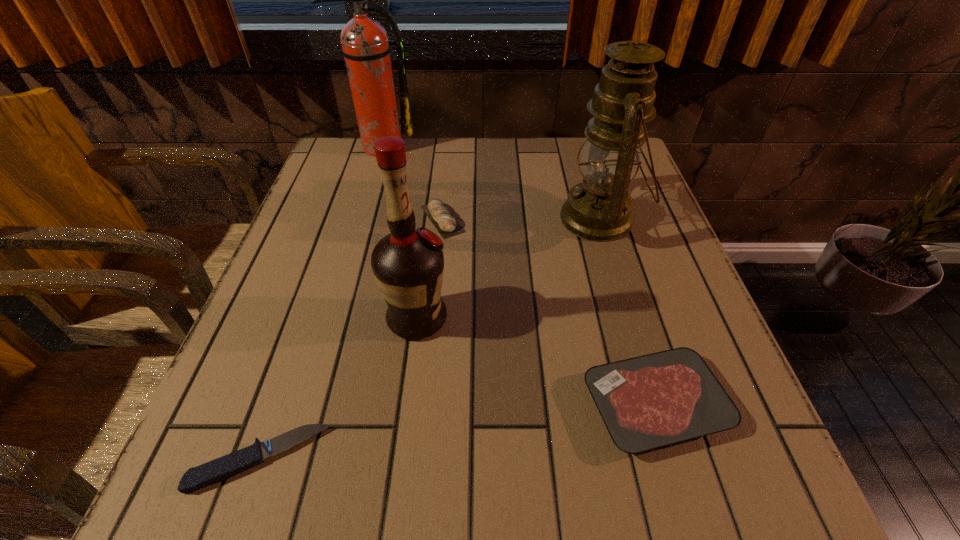
Where is `object present at the near left corner`? object present at the near left corner is located at coordinates (195, 478).

Identify the location of object that is at the near right corner. The height and width of the screenshot is (540, 960). (655, 400).

Image resolution: width=960 pixels, height=540 pixels. Identify the location of free region at the far edge of the desktop. 499,160.

I want to click on free space at the near edge of the desktop, so click(x=553, y=461).

Locate an element on the screen. Image resolution: width=960 pixels, height=540 pixels. vacant position at the left edge of the desktop is located at coordinates (299, 450).

Locate an element on the screen. This screenshot has width=960, height=540. vacant area at the right edge of the desktop is located at coordinates (617, 268).

Where is `free spot between the shortest object and the pita bread`? The image size is (960, 540). free spot between the shortest object and the pita bread is located at coordinates (351, 339).

You are a GUI agent. You are given a task and a screenshot of the screen. Output one action in this format:
    pyautogui.click(x=<x>, y=<y>)
    Task: Click on the free spot between the pita bread and the fire extinguisher
    
    Given the screenshot: What is the action you would take?
    pyautogui.click(x=411, y=183)

Where is `free area in between the farthest object and the fourth tallest object`? free area in between the farthest object and the fourth tallest object is located at coordinates (411, 183).

The height and width of the screenshot is (540, 960). Identify the location of vacant point located between the oil lamp and the fire extinguisher. (491, 183).